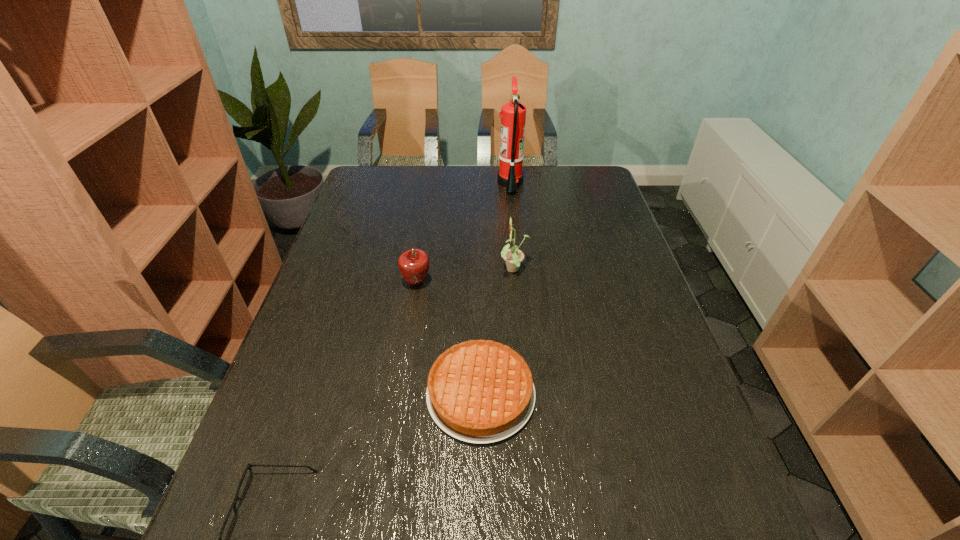
Identify the location of the farthest object. This screenshot has width=960, height=540. (513, 114).

I want to click on the tallest object, so pos(513,114).

This screenshot has height=540, width=960. I want to click on the second tallest object, so click(513, 257).

Find the location of a particular element. This screenshot has width=960, height=540. the third tallest object is located at coordinates 414,264.

Where is `apple`? The height and width of the screenshot is (540, 960). apple is located at coordinates (414, 264).

Where is `pie`? The width and height of the screenshot is (960, 540). pie is located at coordinates (479, 391).

At what (x,y) coordinates should I click in order to perform the action: click on the second nearest object. Please return your answer as a coordinate pair (x, y). The height and width of the screenshot is (540, 960). Looking at the image, I should click on (479, 391).

Locate an element on the screen. The width and height of the screenshot is (960, 540). free space located 0.060m at the nozzle of the tallest object is located at coordinates (481, 183).

Where is `free space located 0.060m at the nozzle of the tallest object`? The width and height of the screenshot is (960, 540). free space located 0.060m at the nozzle of the tallest object is located at coordinates (481, 183).

The image size is (960, 540). Identify the location of free space located 0.330m at the nozzle of the tallest object. (409, 183).